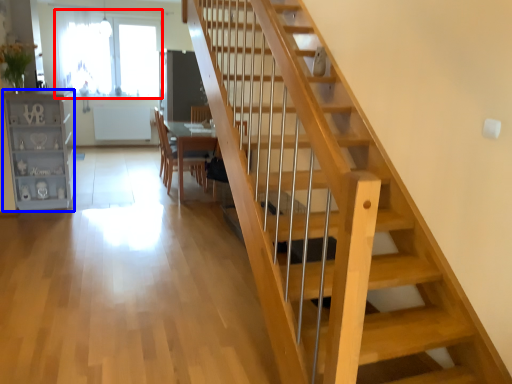
Question: Which of the following is the closest to the observer, window (highlighted by a red box) or bookshelf (highlighted by a blue box)?

Choices:
 (A) window
 (B) bookshelf

Answer: (B)